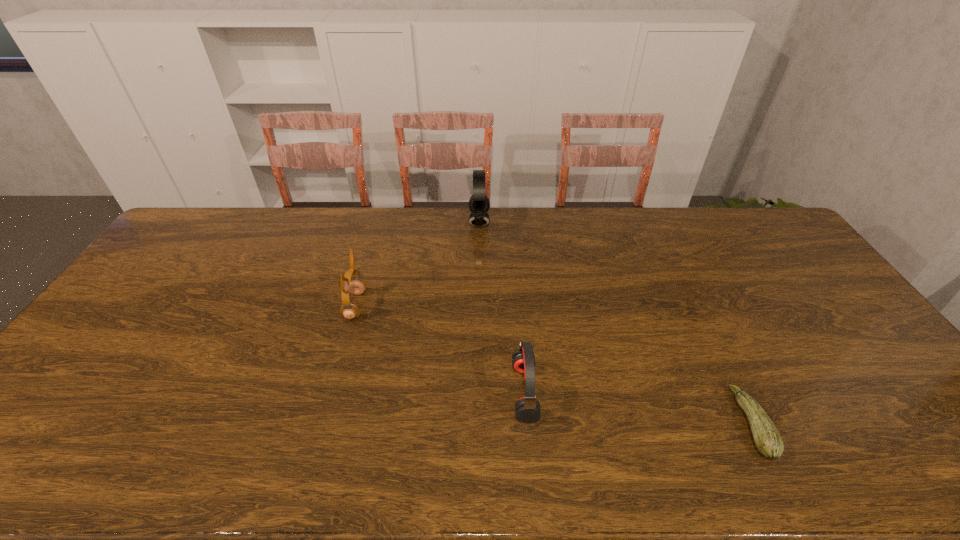
The width and height of the screenshot is (960, 540). I want to click on vacant space that is in between the farthest earphone and the shortest earphone, so click(x=502, y=307).

The height and width of the screenshot is (540, 960). I want to click on free space between the second earphone from left to right and the second farthest earphone, so click(x=418, y=264).

The width and height of the screenshot is (960, 540). I want to click on object that is the third closest to the zucchini, so click(x=350, y=311).

Choose which object is the third nearest neighbor to the farthest object. Please provide its 2D coordinates. Your answer should be formatted as a tuple, i.e. [(x, y)], where the tuple contains the x and y coordinates of a point satisfying the conditions above.

[(768, 441)]

Choose which earphone is the second nearest neighbor to the second farthest object. Please provide its 2D coordinates. Your answer should be formatted as a tuple, i.e. [(x, y)], where the tuple contains the x and y coordinates of a point satisfying the conditions above.

[(527, 408)]

Locate which earphone ranks in proximity to the farthest earphone. Please provide its 2D coordinates. Your answer should be formatted as a tuple, i.e. [(x, y)], where the tuple contains the x and y coordinates of a point satisfying the conditions above.

[(350, 311)]